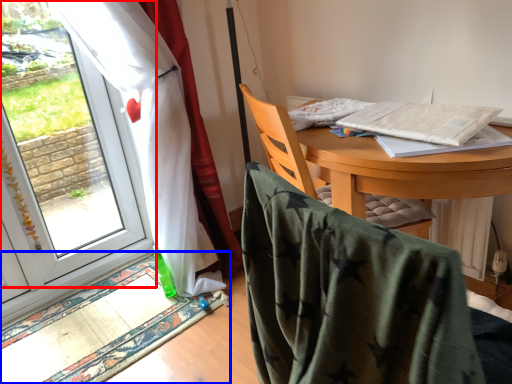
Question: Which object appears farthest to the camera in this image, window (highlighted by a red box) or mat (highlighted by a blue box)?

Choices:
 (A) window
 (B) mat

Answer: (A)